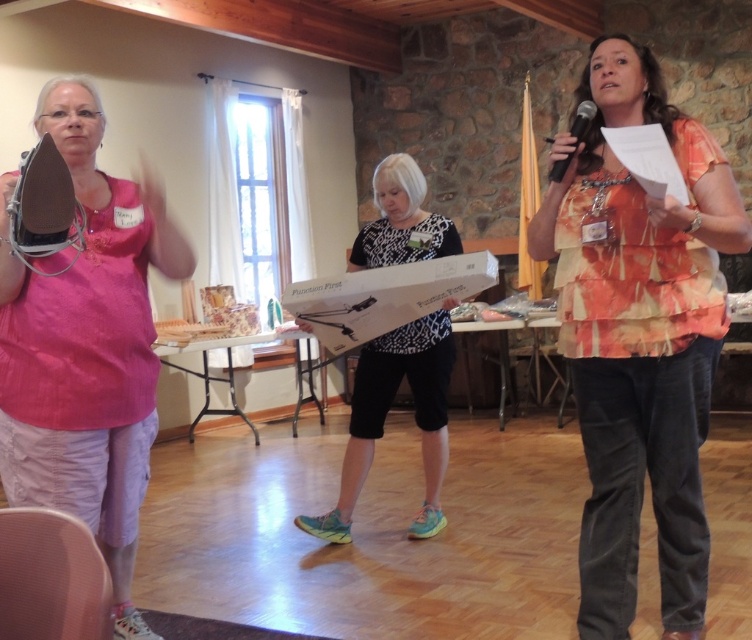
Which of these two, orange tie-dye shirt at center or matte pink shirt at left, stands shorter?

matte pink shirt at left is shorter.

Between orange tie-dye shirt at center and matte pink shirt at left, which one appears on the left side from the viewer's perspective?

From the viewer's perspective, matte pink shirt at left appears more on the left side.

Is point (705, 428) behind point (62, 154)?

Yes, point (705, 428) is behind point (62, 154).

You are a GUI agent. You are given a task and a screenshot of the screen. Output one action in this format:
    pyautogui.click(x=<x>, y=<y>)
    Task: Click on the orange tie-dye shirt at center
    The width and height of the screenshot is (752, 640).
    Given the screenshot: What is the action you would take?
    coord(638,337)

Consider the image. Which is above, orange tie-dye shirt at center or black plastic microphone at upper right?

black plastic microphone at upper right is higher up.

Is orange tie-dye shirt at center closer to camera compared to black plastic microphone at upper right?

Yes, orange tie-dye shirt at center is closer to the viewer.

Is point (632, 310) closer to camera compared to point (584, 128)?

That is True.

You are a GUI agent. You are given a task and a screenshot of the screen. Output one action in this format:
    pyautogui.click(x=<x>, y=<y>)
    Task: Click on the orange tie-dye shirt at center
    The image size is (752, 640).
    Given the screenshot: What is the action you would take?
    pyautogui.click(x=638, y=337)

How distant is matte pink shirt at left from white dotted shirt at center?

matte pink shirt at left is 1.54 meters from white dotted shirt at center.

Does matte pink shirt at left have a lesser height compared to white dotted shirt at center?

Incorrect, matte pink shirt at left's height does not fall short of white dotted shirt at center's.

Is point (86, 454) closer to camera compared to point (420, 362)?

That is True.

Image resolution: width=752 pixels, height=640 pixels. Find the location of `matte pink shirt at left`. matte pink shirt at left is located at coordinates (86, 346).